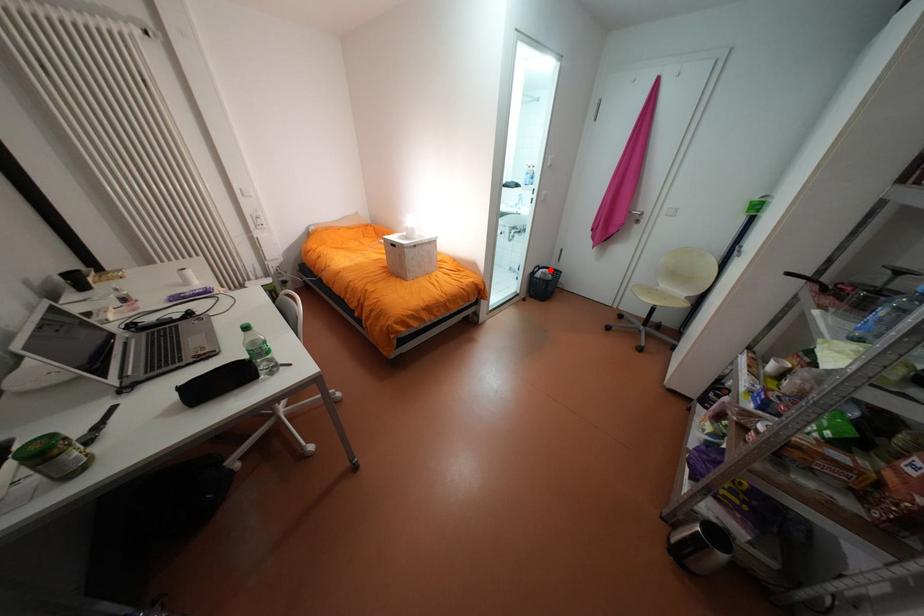
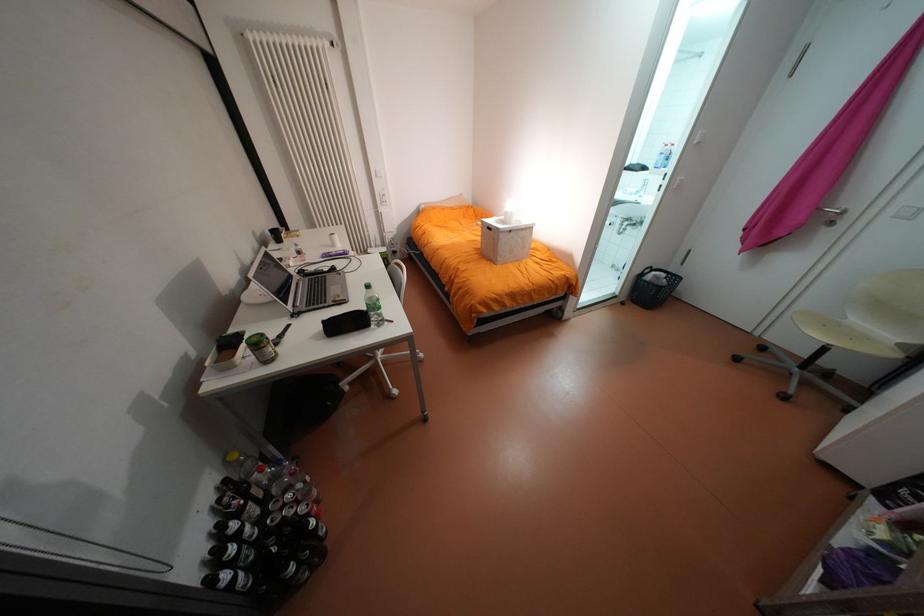
Question: I am providing you with two images of the same scene from different viewpoints. A red point is marked on the first image. At the location where the point appears in image 1, is it still visible in image 2?

Choices:
 (A) Yes
 (B) No

Answer: (A)